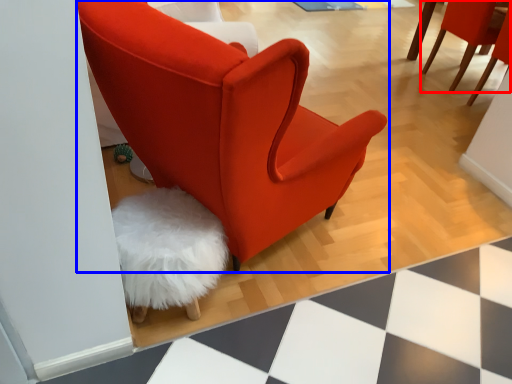
Question: Which of the following is the closest to the observer, chair (highlighted by a red box) or chair (highlighted by a blue box)?

Choices:
 (A) chair
 (B) chair

Answer: (B)